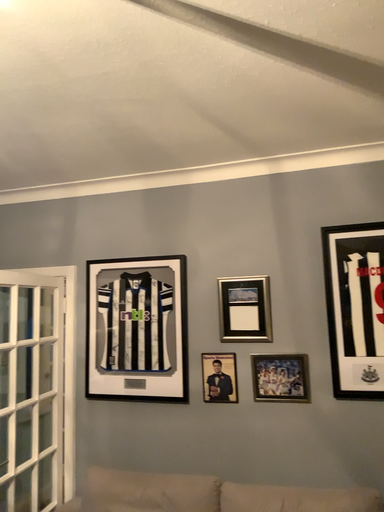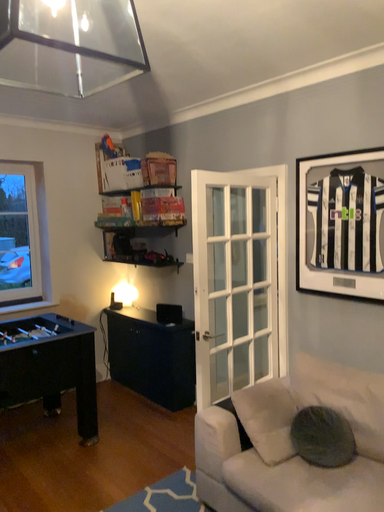
Question: How did the camera likely rotate when shooting the video?

Choices:
 (A) rotated upward
 (B) rotated downward

Answer: (B)